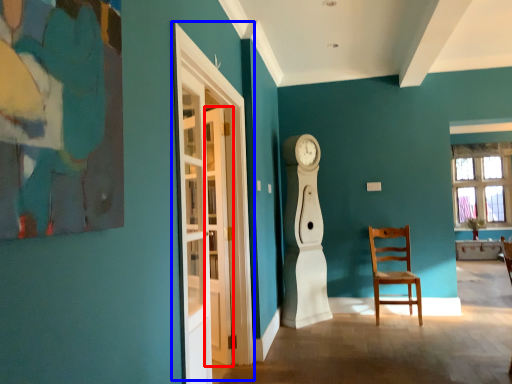
Question: Among these objects, which one is farthest to the camera, door (highlighted by a red box) or glass door (highlighted by a blue box)?

Choices:
 (A) door
 (B) glass door

Answer: (A)